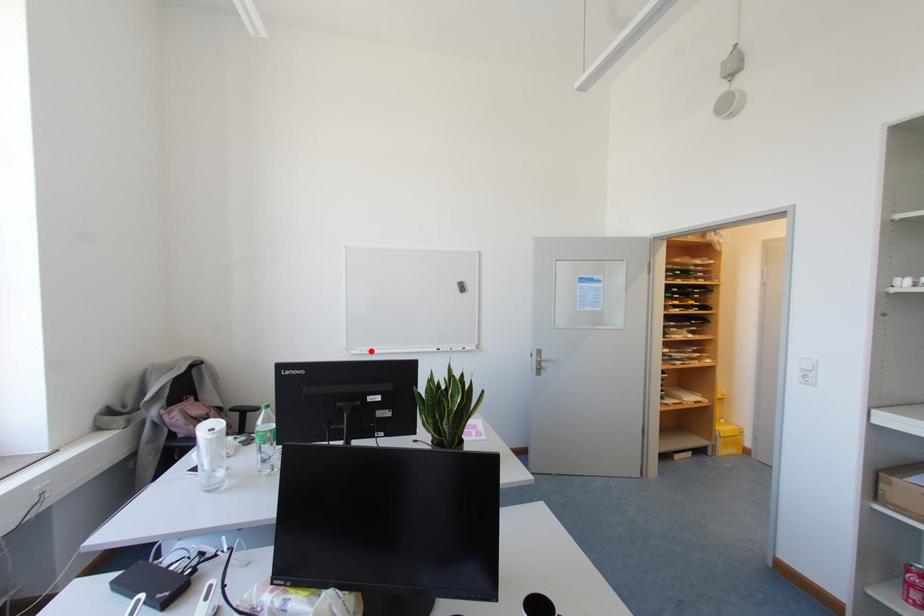
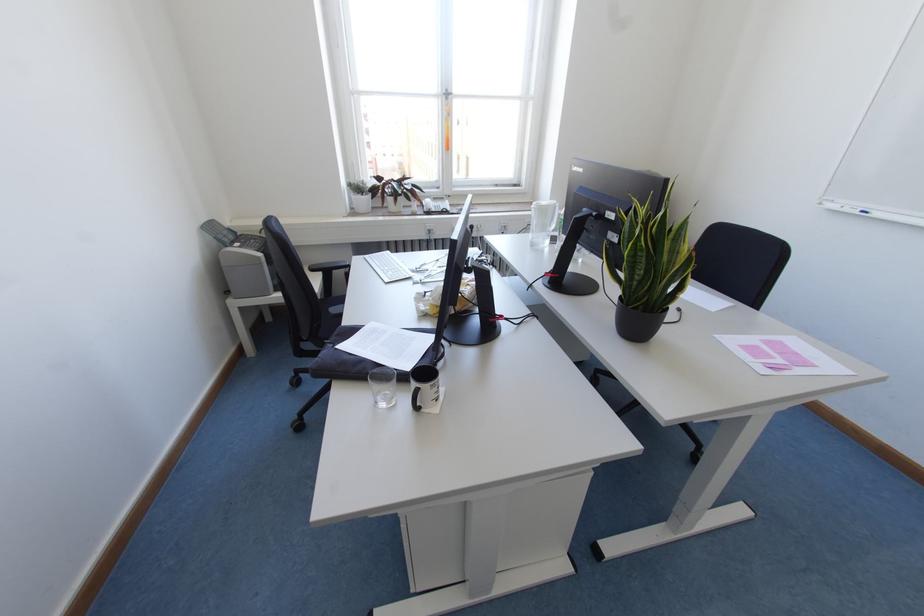
In the second image, find the point that corresponds to the highlighted location in the first image.

(864, 213)